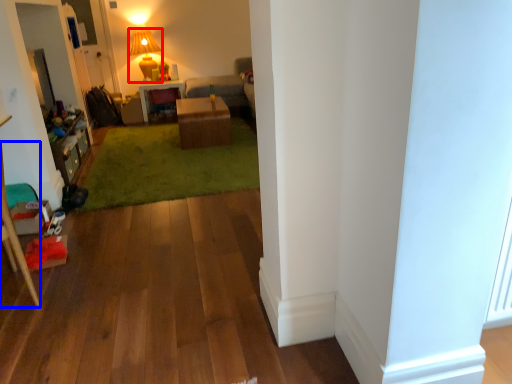
Question: Which object is closer to the camera taking this photo, lamp (highlighted by a red box) or furniture (highlighted by a blue box)?

Choices:
 (A) lamp
 (B) furniture

Answer: (B)